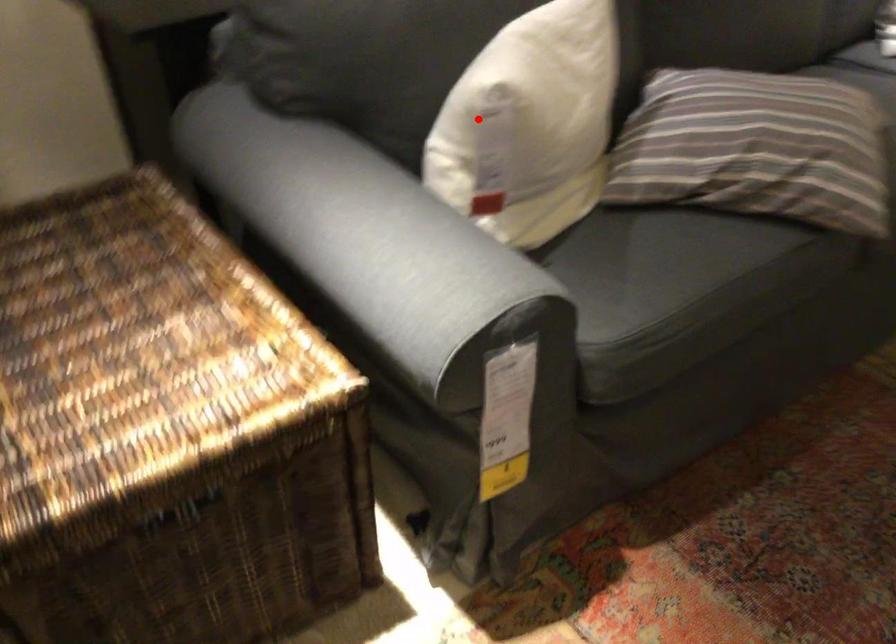
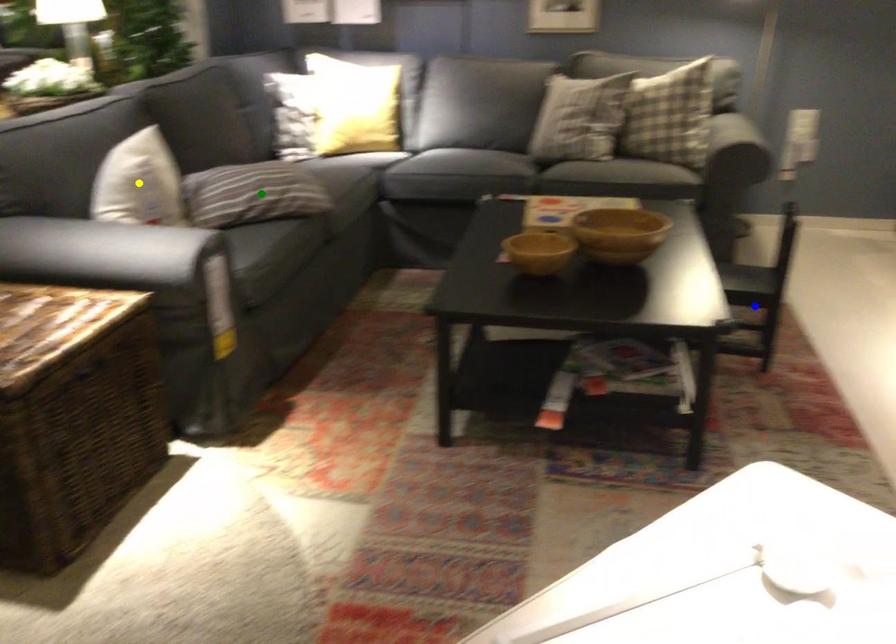
Question: I am providing you with two images of the same scene from different viewpoints. A red point is marked on the first image. You are given multiple points on the second image. Which mark in image 2 goes with the point in image 1?

Choices:
 (A) green point
 (B) yellow point
 (C) blue point

Answer: (B)